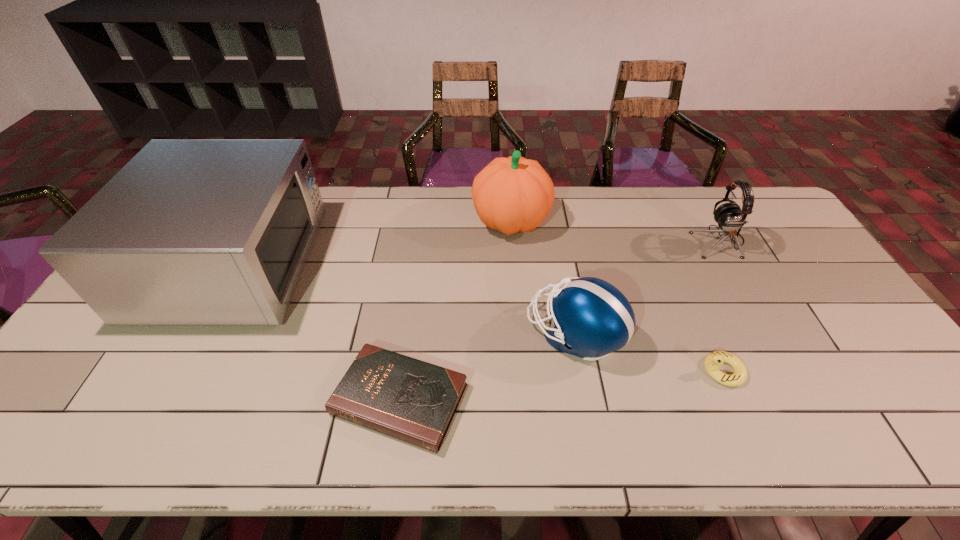
Identify the location of free space located on the right of the pumpkin. (565, 221).

The image size is (960, 540). What are the coordinates of `blank area located on the back of the rightmost object` in the screenshot? It's located at (691, 192).

What are the coordinates of `free space located 0.250m at the front of the football helmet with the faceguard` in the screenshot? It's located at (434, 334).

This screenshot has height=540, width=960. What are the coordinates of `free point located 0.050m at the front of the football helmet with the faceguard` in the screenshot? It's located at (509, 334).

Where is `vacant space situated at the front of the football helmet with the faceguard`? This screenshot has height=540, width=960. vacant space situated at the front of the football helmet with the faceguard is located at coordinates [377, 334].

Where is `free space located 0.080m on the face of the second object from right to left`? free space located 0.080m on the face of the second object from right to left is located at coordinates (668, 371).

Image resolution: width=960 pixels, height=540 pixels. I want to click on vacant space located on the face of the second object from right to left, so click(x=596, y=371).

At what (x,y) coordinates should I click in order to perform the action: click on free region located 0.350m on the face of the second object from right to left. Please return your answer as a coordinate pair (x, y). Looking at the image, I should click on (560, 371).

Find the location of a particular element. The width and height of the screenshot is (960, 540). vacant region located 0.200m on the left of the shortest object is located at coordinates (248, 399).

Locate an element on the screen. The height and width of the screenshot is (540, 960). microwave oven situated at the far edge is located at coordinates (189, 232).